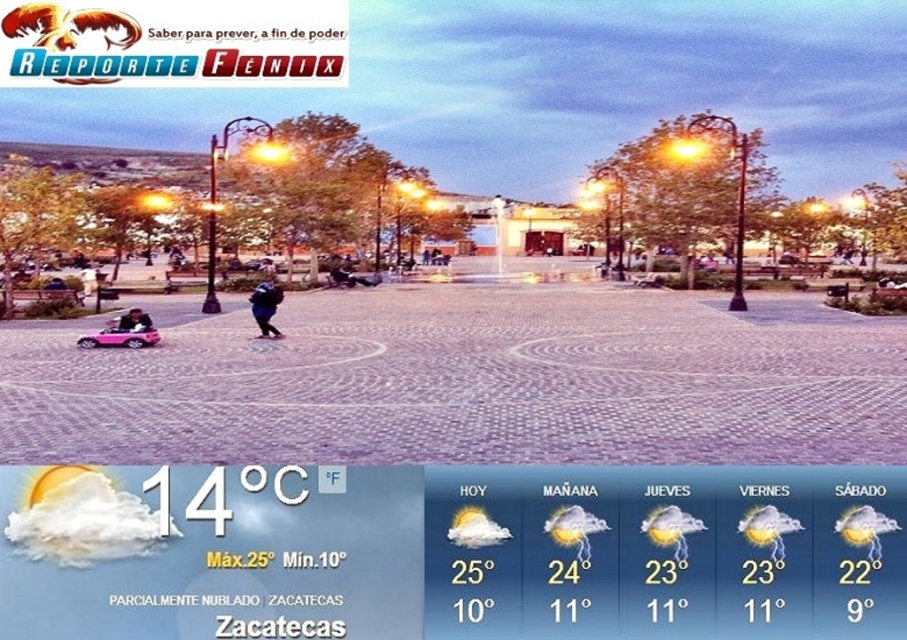
Question: Can you confirm if dark blue fabric jacket at center is wider than matte pink car at lower left?

Choices:
 (A) no
 (B) yes

Answer: (B)

Question: Observing the image, what is the correct spatial positioning of dark blue fabric jacket at center in reference to matte pink car at lower left?

Choices:
 (A) below
 (B) above

Answer: (B)

Question: Which point is farther from the camera taking this photo?

Choices:
 (A) (274, 285)
 (B) (110, 330)

Answer: (A)

Question: Among these points, which one is farthest from the camera?

Choices:
 (A) (122, 323)
 (B) (265, 292)

Answer: (B)

Question: Is dark blue fabric jacket at center above matte pink car at lower left?

Choices:
 (A) no
 (B) yes

Answer: (B)